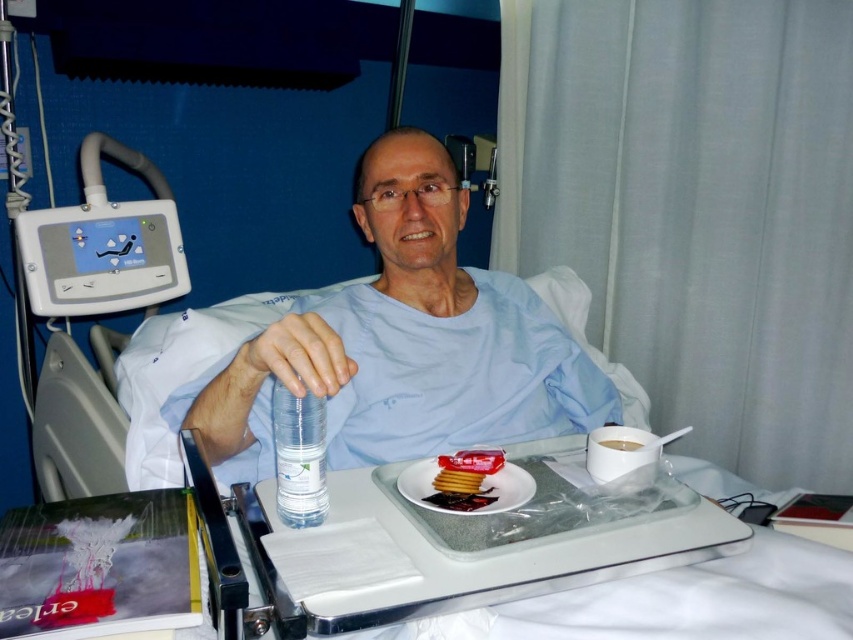
Looking at this image, you are a nurse in a hospital. You need to place a new medication vial on the tray table. The vial is 10 cm tall. The tray table has limited space. Can you fit the vial between the clear plastic tray at center and the white glossy cup at upper right?

The white glossy cup at upper right is behind the clear plastic tray at center, so there is no space between them to place the medication vial. You will need to rearrange items on the tray table to make space.

You are a nurse checking the items on the tray table. You need to place a new medication bottle that is the same size as the transparent plastic bottle at center. Will there be enough space on the clear plastic tray at center to accommodate it without moving existing items?

The clear plastic tray at center has a larger size compared to transparent plastic bottle at center. Since the new medication bottle is the same size as the transparent plastic bottle at center, there should be sufficient space on the clear plastic tray at center to place it without moving existing items.

You are a nurse in a hospital room. You need to place a new medication on the clear plastic tray at center. Where exactly should you place it?

The clear plastic tray at center is located at point 2D coordinates (682, 602), so place the medication there.